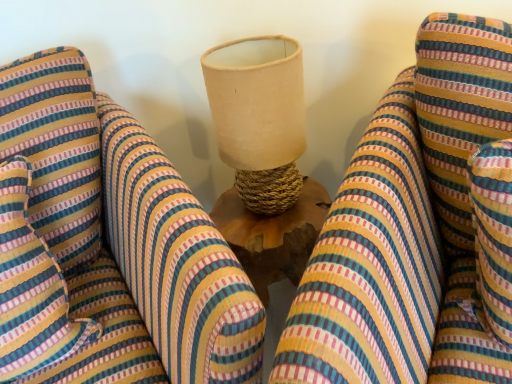
Question: Does striped fabric bean bag chair at center, marked as the 1th bean bag chair in a left-to-right arrangement, have a greater width compared to striped fabric bean bag chair at center, which ranks as the 2th bean bag chair in left-to-right order?

Choices:
 (A) yes
 (B) no

Answer: (A)

Question: Is striped fabric bean bag chair at center, marked as the 1th bean bag chair in a left-to-right arrangement, thinner than striped fabric bean bag chair at center, which ranks as the 2th bean bag chair in left-to-right order?

Choices:
 (A) yes
 (B) no

Answer: (B)

Question: Does striped fabric bean bag chair at center, marked as the 1th bean bag chair in a left-to-right arrangement, lie in front of striped fabric bean bag chair at center, which is the 1th bean bag chair from right to left?

Choices:
 (A) yes
 (B) no

Answer: (B)

Question: From a real-world perspective, is striped fabric bean bag chair at center, the 2th bean bag chair viewed from the right, physically below striped fabric bean bag chair at center, which ranks as the 2th bean bag chair in left-to-right order?

Choices:
 (A) no
 (B) yes

Answer: (B)

Question: Is striped fabric bean bag chair at center, which is the 1th bean bag chair from right to left, completely or partially inside striped fabric bean bag chair at center, marked as the 1th bean bag chair in a left-to-right arrangement?

Choices:
 (A) no
 (B) yes

Answer: (A)

Question: Is point (55, 337) closer or farther from the camera than point (301, 147)?

Choices:
 (A) closer
 (B) farther

Answer: (A)

Question: From a real-world perspective, relative to beige fabric lampshade at center, is striped fabric pillow at left vertically above or below?

Choices:
 (A) above
 (B) below

Answer: (B)

Question: Is striped fabric pillow at left inside or outside of beige fabric lampshade at center?

Choices:
 (A) inside
 (B) outside

Answer: (B)

Question: Considering the positions of striped fabric pillow at left and beige fabric lampshade at center in the image, is striped fabric pillow at left bigger or smaller than beige fabric lampshade at center?

Choices:
 (A) big
 (B) small

Answer: (A)

Question: Based on their positions, is beige fabric lampshade at center located to the left or right of striped fabric pillow at left?

Choices:
 (A) left
 (B) right

Answer: (B)

Question: Considering the positions of beige fabric lampshade at center and striped fabric pillow at left in the image, is beige fabric lampshade at center taller or shorter than striped fabric pillow at left?

Choices:
 (A) tall
 (B) short

Answer: (B)

Question: Looking at the image, does beige fabric lampshade at center seem bigger or smaller compared to striped fabric pillow at left?

Choices:
 (A) small
 (B) big

Answer: (A)

Question: Considering the positions of beige fabric lampshade at center and striped fabric pillow at left in the image, is beige fabric lampshade at center wider or thinner than striped fabric pillow at left?

Choices:
 (A) wide
 (B) thin

Answer: (B)

Question: Is striped fabric pillow at left wider or thinner than striped fabric bean bag chair at center, which ranks as the 2th bean bag chair in left-to-right order?

Choices:
 (A) thin
 (B) wide

Answer: (A)

Question: Relative to striped fabric bean bag chair at center, which ranks as the 2th bean bag chair in left-to-right order, is striped fabric pillow at left in front or behind?

Choices:
 (A) front
 (B) behind

Answer: (B)